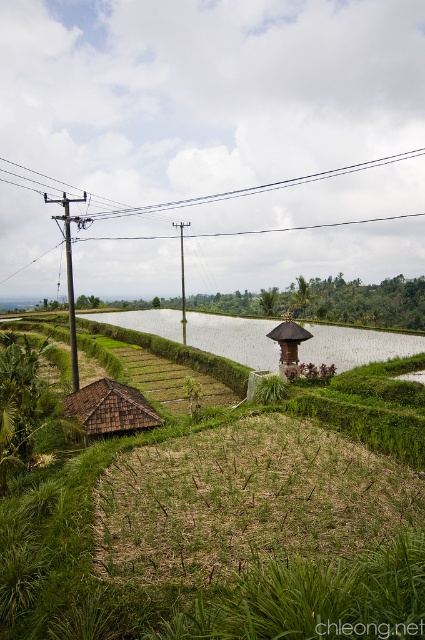
Can you confirm if black wire at upper center is positioned to the left of brown wooden telegraph pole at center?

In fact, black wire at upper center is to the right of brown wooden telegraph pole at center.

Can you confirm if black wire at upper center is positioned below brown wooden telegraph pole at center?

No.

Which is in front, point (121, 208) or point (181, 244)?

Point (181, 244)

Where is `black wire at upper center`? The height and width of the screenshot is (640, 425). black wire at upper center is located at coordinates (255, 188).

In the scene shown: Which is more to the right, brown thatched hut at lower left or brown wooden telegraph pole at left?

Positioned to the right is brown thatched hut at lower left.

Is point (93, 433) less distant than point (70, 253)?

Yes, it is in front of point (70, 253).

Locate an element on the screen. The image size is (425, 640). brown thatched hut at lower left is located at coordinates (110, 406).

Can you confirm if black wire at upper center is positioned to the left of brown wooden hut at center?

No, black wire at upper center is not to the left of brown wooden hut at center.

Who is shorter, black wire at upper center or brown wooden hut at center?

brown wooden hut at center is shorter.

Between point (376, 157) and point (286, 365), which one is positioned behind?

The point (376, 157) is more distant.

At what (x,y) coordinates should I click in order to perform the action: click on black wire at upper center. Please return your answer as a coordinate pair (x, y). Image resolution: width=425 pixels, height=640 pixels. Looking at the image, I should click on (255, 188).